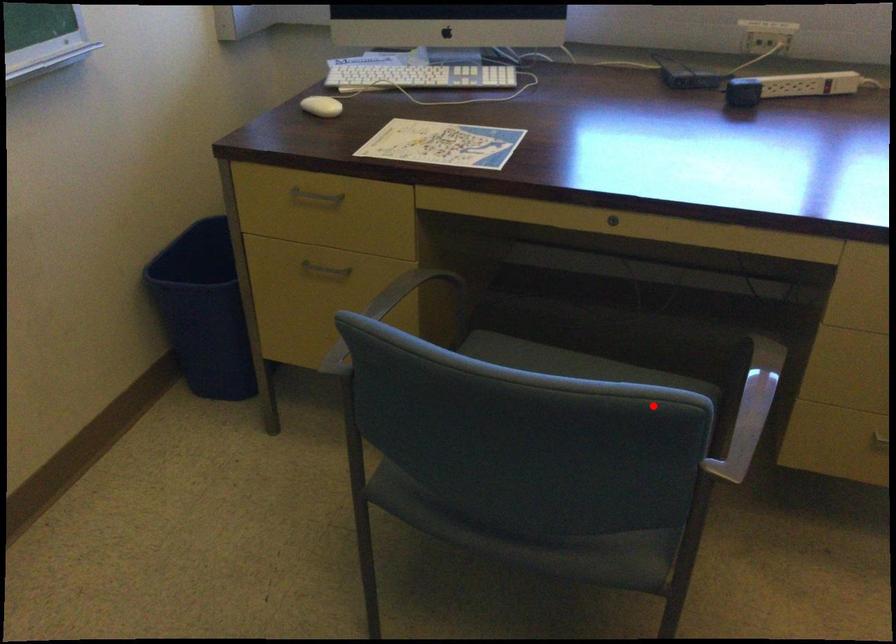
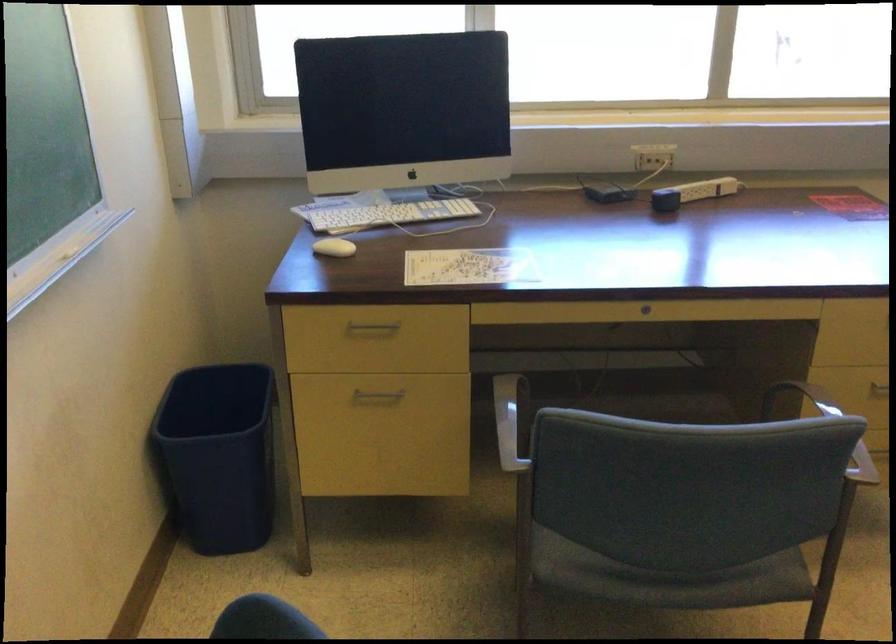
In the second image, find the point that corresponds to the highlighted location in the first image.

(825, 427)